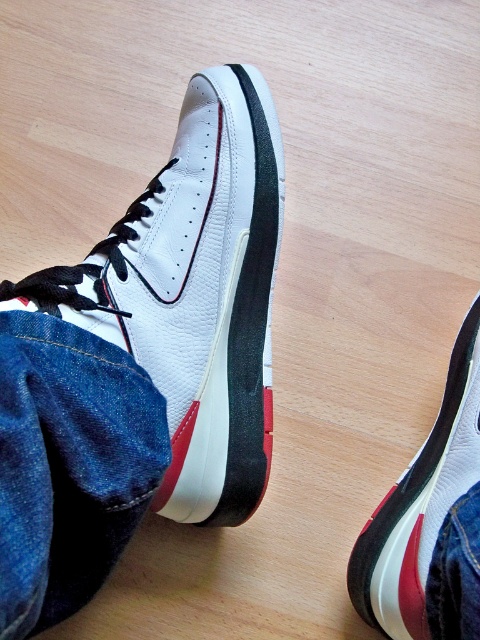
Question: Which point is farther to the camera?

Choices:
 (A) denim at lower right
 (B) denim at lower left
 (C) white matte/suede sneaker at lower center
 (D) white leather sneaker at center

Answer: (D)

Question: Among these points, which one is farthest from the camera?

Choices:
 (A) (155, 280)
 (B) (468, 496)
 (C) (374, 576)
 (D) (25, 528)

Answer: (A)

Question: Does white leather sneaker at center have a lesser width compared to denim at lower right?

Choices:
 (A) no
 (B) yes

Answer: (A)

Question: Based on their relative distances, which object is farther from the denim at lower right?

Choices:
 (A) white leather sneaker at center
 (B) white matte/suede sneaker at lower center

Answer: (A)

Question: Is the position of denim at lower left more distant than that of white matte/suede sneaker at lower center?

Choices:
 (A) no
 (B) yes

Answer: (A)

Question: Observing the image, what is the correct spatial positioning of denim at lower left in reference to white matte/suede sneaker at lower center?

Choices:
 (A) right
 (B) left

Answer: (B)